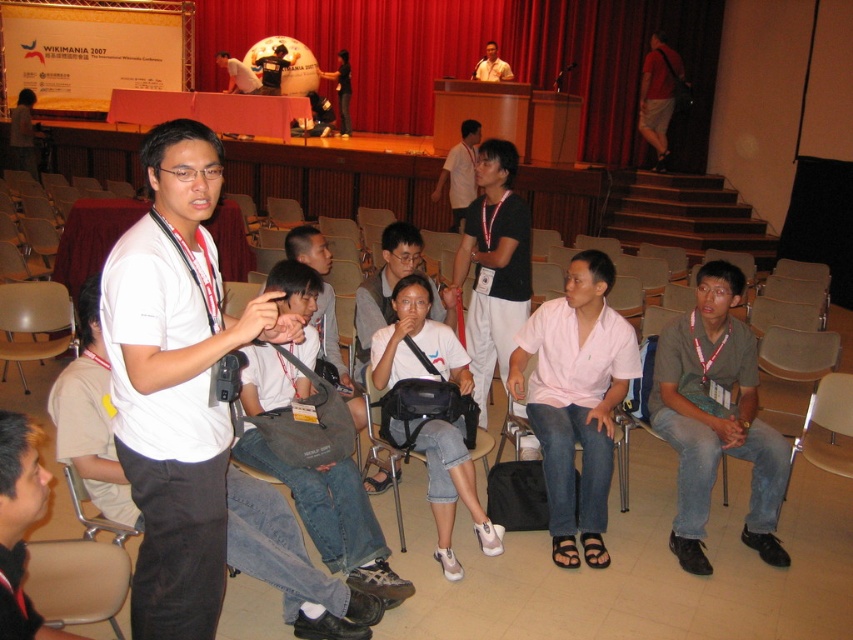
You are standing in the audience of the Wikimania 2007 conference and notice two points marked on the stage. The first point is at coordinates point (463, 161) and the second is at point (347, 74). Which point is nearer to your current position?

Point (463, 161) is closer to the camera than point (347, 74), so the first point is nearer to your current position.

You are organizing a photo shoot in the conference venue and need to place a large prop that takes up the same space as the denim jeans at center. Will this prop also fit in the space where the beige leather chair at lower left is currently placed?

The denim jeans at center is larger in size than the beige leather chair at lower left. Therefore, the prop that takes up the same space as the denim jeans at center may not fit in the space of the beige leather chair at lower left due to the size difference.

In the image of the Wikimania 2007 conference, there are two people seated in the audience. One is wearing a dark brown leather jacket at lower left and the other a matte black shirt at center. From the perspective of someone sitting in the front row, which person is sitting to the right of the other?

The dark brown leather jacket at lower left is to the right of the matte black shirt at center, so from the front row perspective, the person in the dark brown leather jacket at lower left is sitting to the right of the matte black shirt at center.